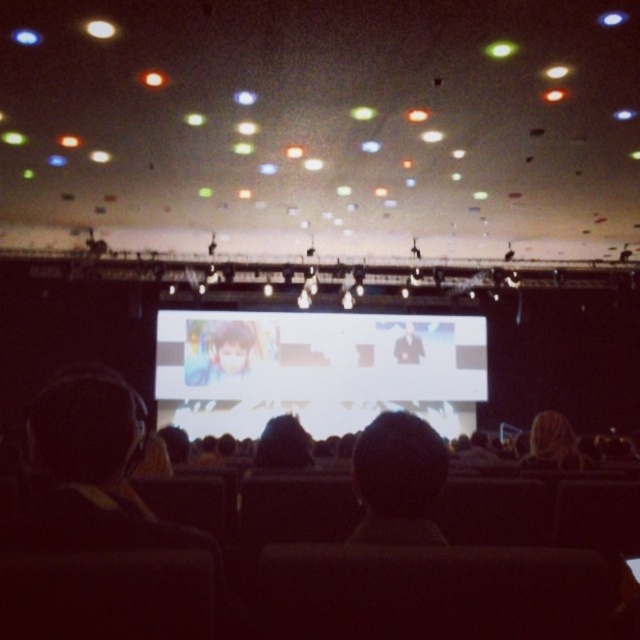
Question: Is white glossy projection screen at center bigger than smooth black hair at center?

Choices:
 (A) yes
 (B) no

Answer: (A)

Question: Which object appears farthest from the camera in this image?

Choices:
 (A) smooth black hair at center
 (B) dark hair at center
 (C) smooth brown hair at center
 (D) smooth skin portrait at center

Answer: (D)

Question: Is smooth brown hair at center below smooth black hair at center?

Choices:
 (A) no
 (B) yes

Answer: (B)

Question: Is dark hair at center to the left of smooth brown hair at center from the viewer's perspective?

Choices:
 (A) no
 (B) yes

Answer: (B)

Question: Estimate the real-world distances between objects in this image. Which object is closer to the white glossy projection screen at center?

Choices:
 (A) dark hair at center
 (B) smooth black hair at center
 (C) smooth skin portrait at center

Answer: (C)

Question: Among these points, which one is nearest to the camera?

Choices:
 (A) (192, 355)
 (B) (275, 417)
 (C) (531, 452)

Answer: (C)